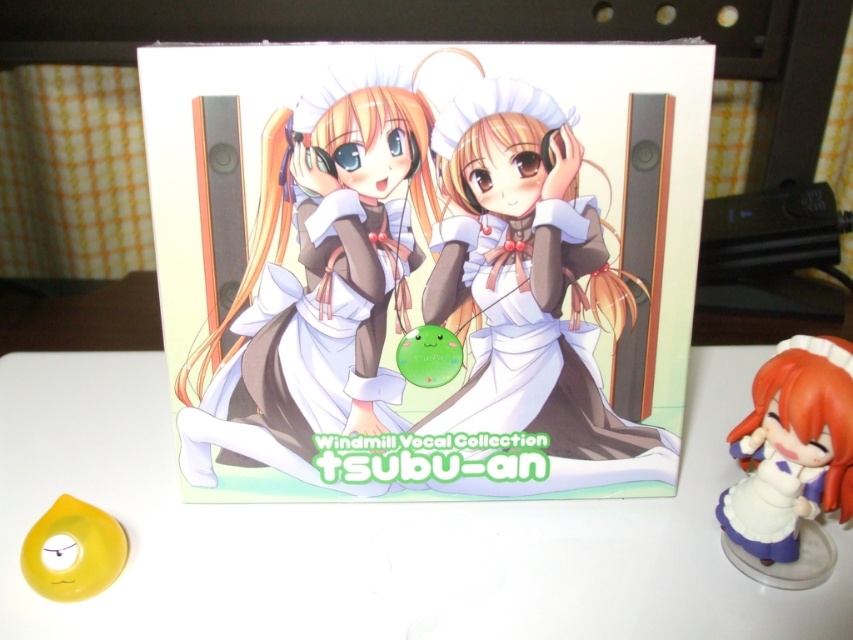
Based on the photo, you are holding a ruler and want to measure the distance between the point at coordinates point (492, 161) and your eyes. Can you determine if the distance is more than 20 inches?

The distance between point (492, 161) and the viewer is 21.86 inches, so yes, the distance is more than 20 inches.

You are an art curator examining the box. You need to place a sticker exactly at the center of the matte brown dress at center. What are the coordinates where you should place the sticker?

The coordinates for the center of the matte brown dress at center are at point (x=318, y=276).